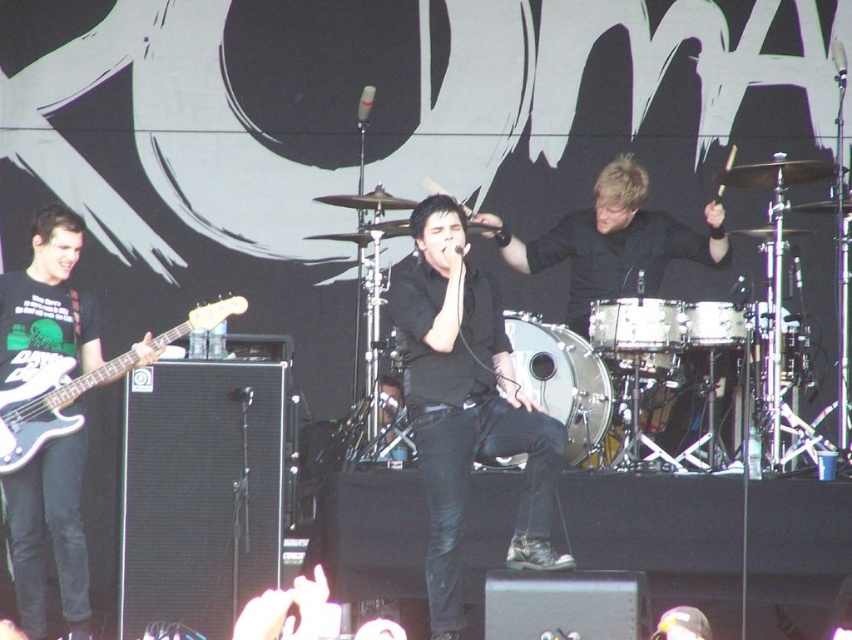
Question: Which object appears closest to the camera in this image?

Choices:
 (A) matte black guitar at left
 (B) black matte shirt at center

Answer: (B)

Question: Estimate the real-world distances between objects in this image. Which object is farther from the white matte electric guitar at left?

Choices:
 (A) matte black guitar at left
 (B) black matte shirt at center

Answer: (B)

Question: Is black matte shirt at center thinner than white matte electric guitar at left?

Choices:
 (A) yes
 (B) no

Answer: (A)

Question: Which object is farther from the camera taking this photo?

Choices:
 (A) matte black guitar at left
 (B) white matte electric guitar at left

Answer: (A)

Question: Can you confirm if black matte shirt at center is wider than white matte electric guitar at left?

Choices:
 (A) yes
 (B) no

Answer: (B)

Question: Is black matte shirt at center thinner than white matte electric guitar at left?

Choices:
 (A) no
 (B) yes

Answer: (B)